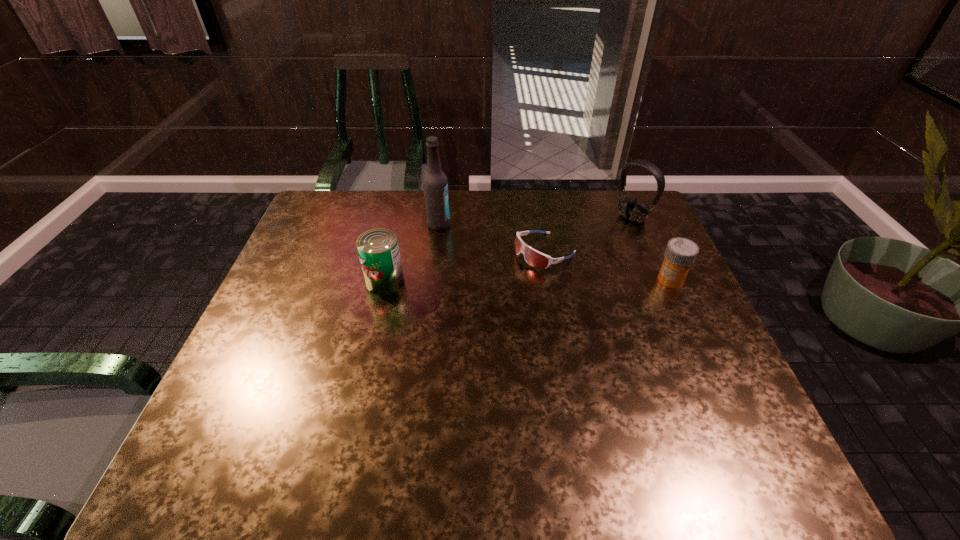
Image resolution: width=960 pixels, height=540 pixels. I want to click on vacant space on the desktop that is between the can and the medicine and is positioned on the front-facing side of the fourth shortest object, so click(x=537, y=280).

Locate an element on the screen. Image resolution: width=960 pixels, height=540 pixels. vacant space on the desktop that is between the third shortest object and the second shortest object and is positioned on the front-facing side of the goggles is located at coordinates (488, 280).

Locate an element on the screen. This screenshot has width=960, height=540. vacant spot on the desktop that is between the third shortest object and the medicine and is positioned on the label of the fourth object from right to left is located at coordinates (560, 280).